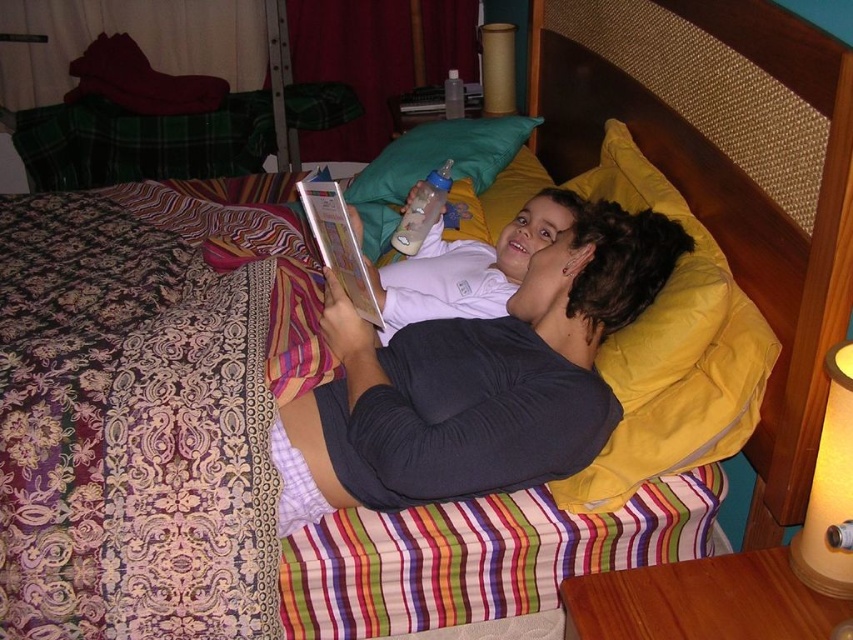
What is the location of the yellow fabric lampshade at right in the image?

The yellow fabric lampshade at right is located at point 0.767 on the x axis and 0.974 on the y axis.

You are taking a photo of the two people on the bed. Which of the two points, point (828, 420) or point (512, 33), is closer to the camera?

Point (828, 420) is closer to the camera than point (512, 33).

You are a delivery robot that is 1.2 meters tall. You need to place a package on the bed where the hardcover book at center is located. Can you reach the bed to place the package there?

The hardcover book at center is 1.13 meters away from the viewer, so the delivery robot that is 1.2 meters tall can reach the bed to place the package there since its height exceeds the distance required.